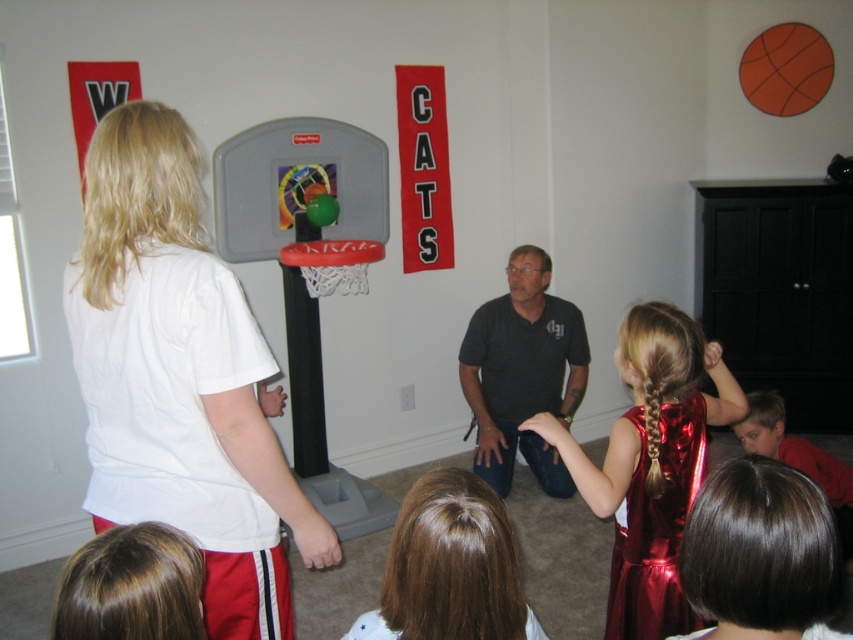
You are a photographer trying to capture a photo of the dark gray shirt at center and the shiny dark brown hair at lower right. Which object is closer to the camera?

The shiny dark brown hair at lower right is closer to the camera because it is positioned below the dark gray shirt at center, meaning it is lower in the frame and thus nearer to the viewer.

Looking at this image, you are standing at the entrance of the room and want to find the shiny red dress at center. According to the room layout, where should you look to find it?

The shiny red dress at center is located at the coordinates point (651, 464) in the room, so you should look towards the center area of the room to find it.